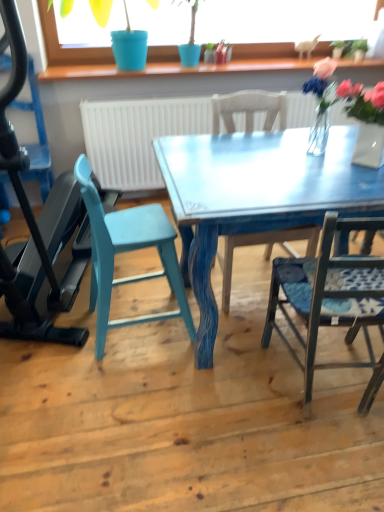
Question: Should I look upward or downward to see green matte plant at upper right?

Choices:
 (A) down
 (B) up

Answer: (B)

Question: Does teal painted wood chair at left, which is the fourth chair in right-to-left order, have a greater height compared to translucent glass vase at upper right, the second floral arrangement when ordered from right to left?

Choices:
 (A) yes
 (B) no

Answer: (A)

Question: From the image's perspective, does teal painted wood chair at left, which is the fourth chair in right-to-left order, appear higher than translucent glass vase at upper right, the 1th floral arrangement in the left-to-right sequence?

Choices:
 (A) yes
 (B) no

Answer: (A)

Question: Is teal painted wood chair at left, which ranks as the first chair in left-to-right order, far from translucent glass vase at upper right, the second floral arrangement when ordered from right to left?

Choices:
 (A) no
 (B) yes

Answer: (B)

Question: Is teal painted wood chair at left, which ranks as the first chair in left-to-right order, to the left of translucent glass vase at upper right, the 1th floral arrangement in the left-to-right sequence, from the viewer's perspective?

Choices:
 (A) no
 (B) yes

Answer: (B)

Question: Does teal painted wood chair at left, which is the fourth chair in right-to-left order, have a smaller size compared to translucent glass vase at upper right, the second floral arrangement when ordered from right to left?

Choices:
 (A) yes
 (B) no

Answer: (B)

Question: Would you say teal painted wood chair at left, which ranks as the first chair in left-to-right order, contains translucent glass vase at upper right, the second floral arrangement when ordered from right to left?

Choices:
 (A) yes
 (B) no

Answer: (B)

Question: Can you confirm if metallic blue treadmill at left is positioned to the left of blue plastic pot at upper center?

Choices:
 (A) yes
 (B) no

Answer: (A)

Question: Can you confirm if metallic blue treadmill at left is taller than blue plastic pot at upper center?

Choices:
 (A) yes
 (B) no

Answer: (A)

Question: Is metallic blue treadmill at left oriented away from blue plastic pot at upper center?

Choices:
 (A) yes
 (B) no

Answer: (A)

Question: Is metallic blue treadmill at left in contact with blue plastic pot at upper center?

Choices:
 (A) yes
 (B) no

Answer: (B)

Question: From the image's perspective, does metallic blue treadmill at left appear lower than blue plastic pot at upper center?

Choices:
 (A) yes
 (B) no

Answer: (A)

Question: From a real-world perspective, does metallic blue treadmill at left sit lower than blue plastic pot at upper center?

Choices:
 (A) no
 (B) yes

Answer: (B)

Question: Is the depth of metallic blue chair at right, which is the 1th chair in right-to-left order, greater than that of translucent glass vase at upper right, the second floral arrangement when ordered from right to left?

Choices:
 (A) yes
 (B) no

Answer: (B)